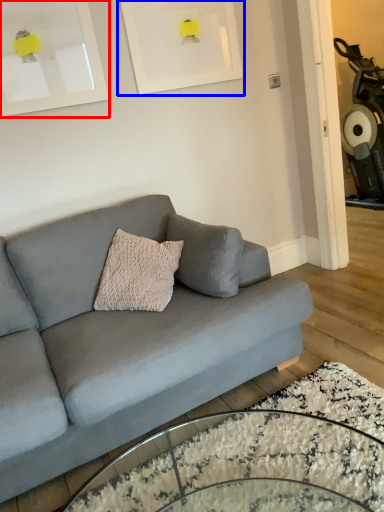
Question: Which of the following is the farthest to the observer, picture frame (highlighted by a red box) or picture frame (highlighted by a blue box)?

Choices:
 (A) picture frame
 (B) picture frame

Answer: (B)